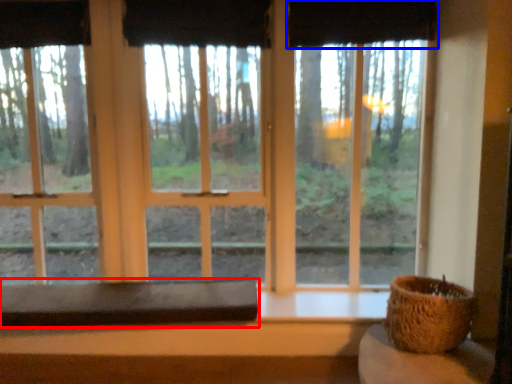
Question: Among these objects, which one is nearest to the camera, table (highlighted by a red box) or curtain (highlighted by a blue box)?

Choices:
 (A) table
 (B) curtain

Answer: (A)